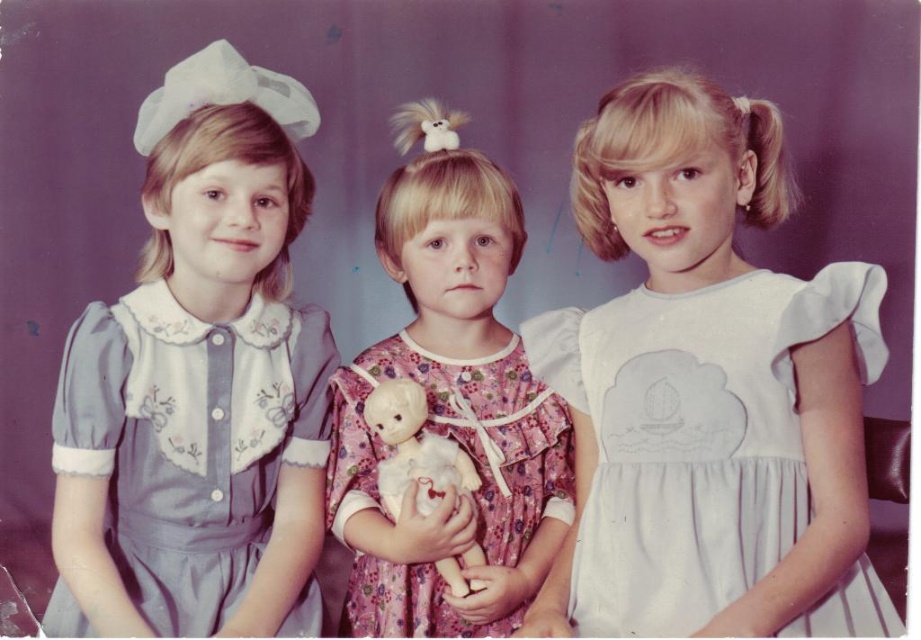
Question: Does white satin dress at center have a greater width compared to floral cotton dress at center?

Choices:
 (A) no
 (B) yes

Answer: (B)

Question: Is white satin dress at center below white plush doll at center?

Choices:
 (A) yes
 (B) no

Answer: (B)

Question: Is white satin dress at center to the left of white plush doll at center from the viewer's perspective?

Choices:
 (A) no
 (B) yes

Answer: (A)

Question: Which of the following is the farthest from the observer?

Choices:
 (A) (398, 497)
 (B) (706, 435)

Answer: (A)

Question: Estimate the real-world distances between objects in this image. Which object is closer to the white plush doll at center?

Choices:
 (A) white satin dress at center
 (B) light blue cotton dress at left

Answer: (B)

Question: Which of the following is the farthest from the observer?

Choices:
 (A) light blue cotton dress at left
 (B) white satin dress at center
 (C) white plush doll at center

Answer: (A)